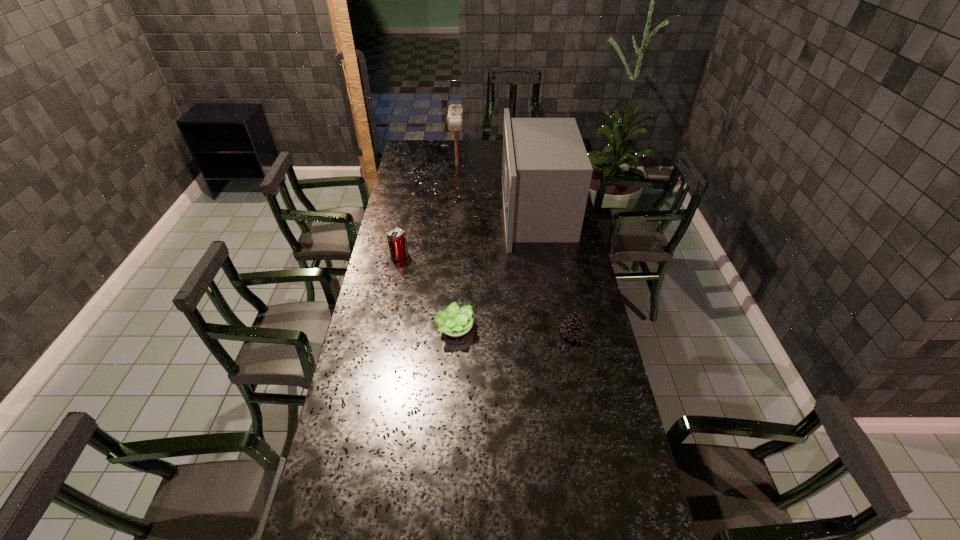
Where is `vacant space located 0.400m on the striking face of the mallet`? The width and height of the screenshot is (960, 540). vacant space located 0.400m on the striking face of the mallet is located at coordinates (454, 218).

The width and height of the screenshot is (960, 540). Find the location of `vacant region located on the front of the third tallest object`. vacant region located on the front of the third tallest object is located at coordinates (391, 301).

This screenshot has height=540, width=960. I want to click on blank space located 0.300m at the narrow end of the fourth tallest object, so click(x=475, y=333).

Locate an element on the screen. The width and height of the screenshot is (960, 540). free region located at the narrow end of the fourth tallest object is located at coordinates (480, 333).

Find the location of a particular element. vacant space situated 0.360m at the narrow end of the fourth tallest object is located at coordinates (458, 333).

Find the location of a particular element. blank area located on the right of the shortest object is located at coordinates (550, 328).

Identify the location of object at the far edge. This screenshot has height=540, width=960. (455, 112).

The image size is (960, 540). Find the location of `object positioned at the left edge`. object positioned at the left edge is located at coordinates (396, 237).

Image resolution: width=960 pixels, height=540 pixels. In order to click on microwave oven that is at the right edge in this screenshot , I will do `click(546, 173)`.

Identify the location of pinecone present at the right edge. The width and height of the screenshot is (960, 540). (573, 327).